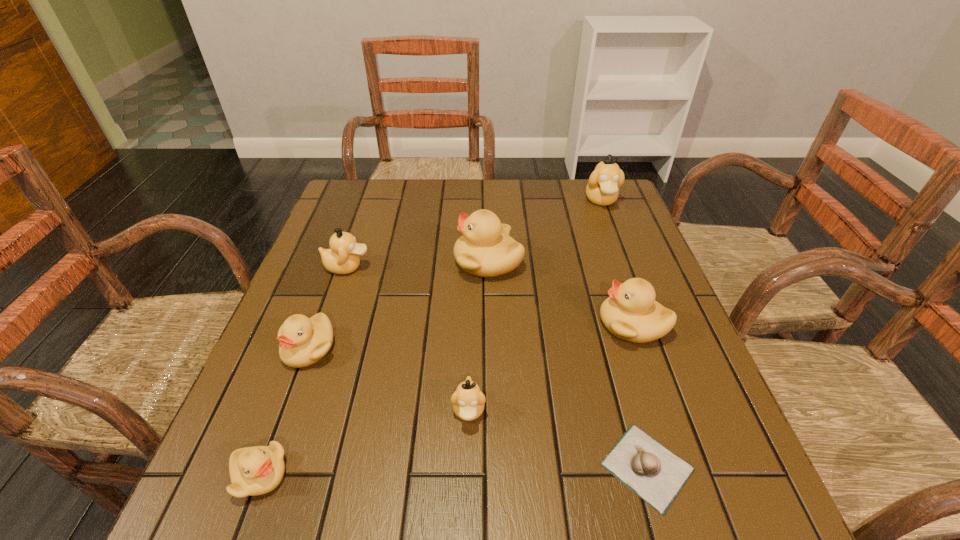
At what (x,y) coordinates should I click in order to perform the action: click on object located in the far right corner section of the desktop. Please return your answer as a coordinate pair (x, y). Looking at the image, I should click on (602, 189).

Where is `object at the near right corner`? object at the near right corner is located at coordinates (653, 472).

This screenshot has height=540, width=960. Identify the location of vacant space at the far edge. (430, 206).

The height and width of the screenshot is (540, 960). In the image, there is a desktop. What are the coordinates of `vacant region at the near edge` in the screenshot? It's located at [x=618, y=518].

At what (x,y) coordinates should I click in order to perform the action: click on free region at the left edge. Please return your answer as a coordinate pair (x, y). The height and width of the screenshot is (540, 960). Looking at the image, I should click on (270, 417).

Where is `vacant space at the right edge of the desktop`? Image resolution: width=960 pixels, height=540 pixels. vacant space at the right edge of the desktop is located at coordinates (618, 272).

This screenshot has width=960, height=540. In the image, there is a desktop. Identify the location of free space at the far left corner. (372, 217).

The image size is (960, 540). In order to click on empty location between the second smallest yellow duckling and the smallest tan duckling in this screenshot , I will do `click(389, 379)`.

Identify the location of vacant area that lies between the second nearest duckling and the second smallest yellow duckling. The image size is (960, 540). pos(389,379).

Identify the location of free space between the third yellow duckling from left to right and the leftmost tan duckling. (418, 264).